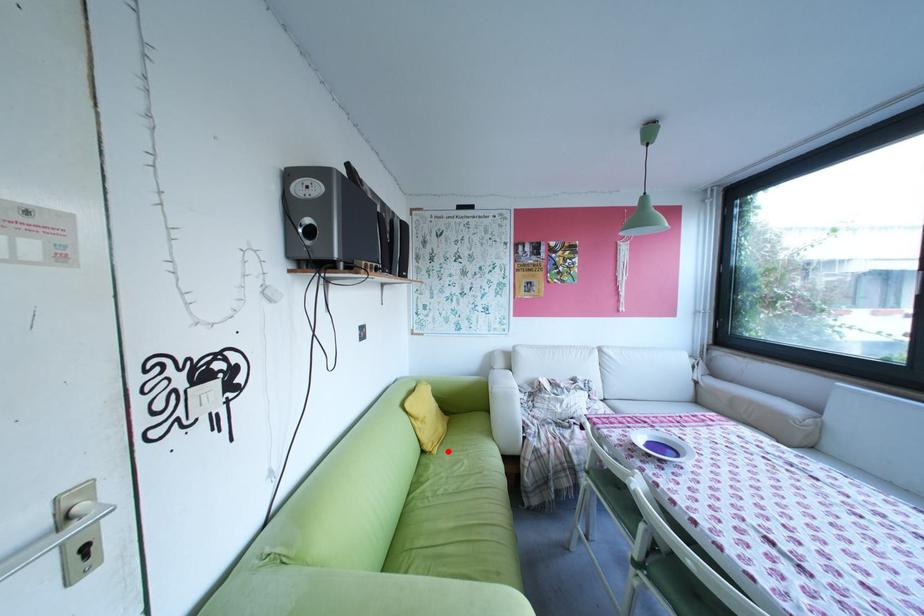
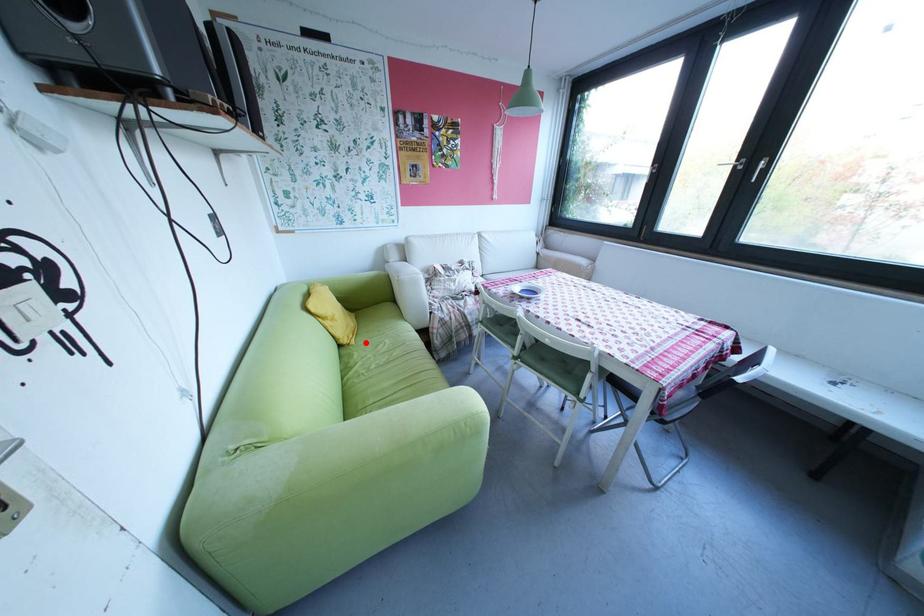
I am providing you with two images of the same scene from different viewpoints. A red point is marked on the first image and another point is marked on the second image. Is the red point in image1 aligned with the point shown in image2?

Yes